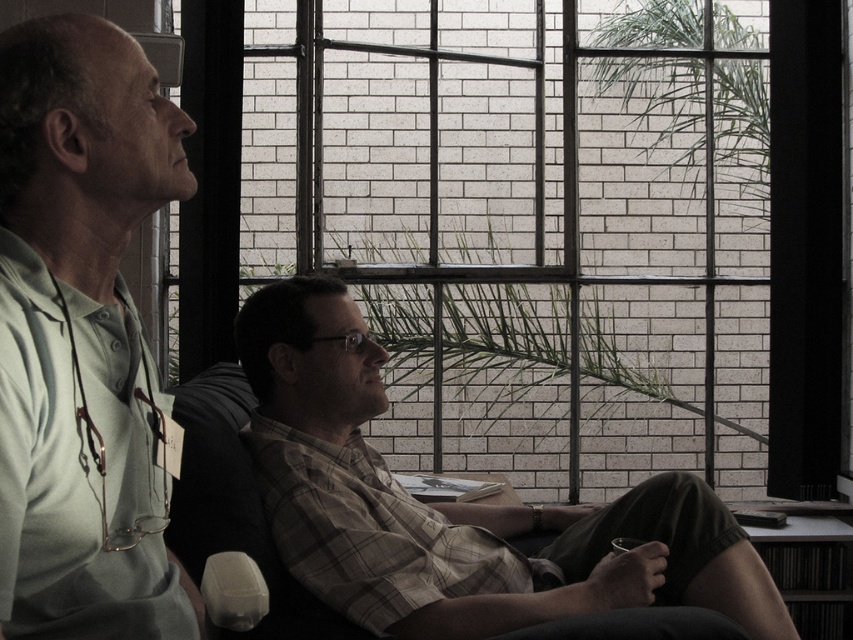
Consider the image. Can you confirm if plaid shirt at center is positioned above green matte shirt at left?

Actually, plaid shirt at center is below green matte shirt at left.

Can you confirm if plaid shirt at center is wider than green matte shirt at left?

Correct, the width of plaid shirt at center exceeds that of green matte shirt at left.

Locate an element on the screen. The width and height of the screenshot is (853, 640). plaid shirt at center is located at coordinates (456, 506).

Can you confirm if clear glass window at center is thinner than green matte shirt at left?

In fact, clear glass window at center might be wider than green matte shirt at left.

Is clear glass window at center taller than green matte shirt at left?

Indeed, clear glass window at center has a greater height compared to green matte shirt at left.

Where is `clear glass window at center`? Image resolution: width=853 pixels, height=640 pixels. clear glass window at center is located at coordinates (544, 225).

Between point (780, 380) and point (367, 385), which one is positioned in front?

Point (367, 385) is more forward.

Does clear glass window at center have a smaller size compared to plaid shirt at center?

No.

Between point (440, 8) and point (404, 513), which one is positioned behind?

Point (440, 8)

At what (x,y) coordinates should I click in order to perform the action: click on clear glass window at center. Please return your answer as a coordinate pair (x, y). The height and width of the screenshot is (640, 853). Looking at the image, I should click on (544, 225).